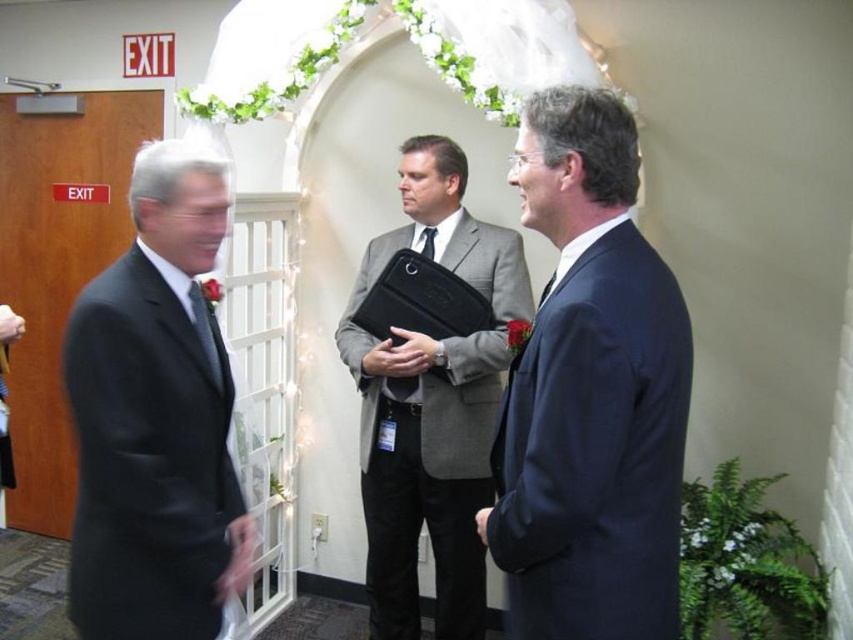
Consider the image. You are a photographer at the event and want to capture a clear shot of both the navy blue suit at center and the matte black tie at left. Given their positions, which one should you focus on first to ensure both are in focus?

The navy blue suit at center is below the matte black tie at left, so focusing on the matte black tie at left first will ensure both are in focus as the navy blue suit at center is closer to the camera.

You are a photographer at the event and need to adjust the camera focus. The navy blue suit at center and the matte black tie at left are in your view. Which object should you focus on if you want to capture the larger one clearly?

The navy blue suit at center is bigger than the matte black tie at left, so you should focus on the navy blue suit at center to capture the larger one clearly.